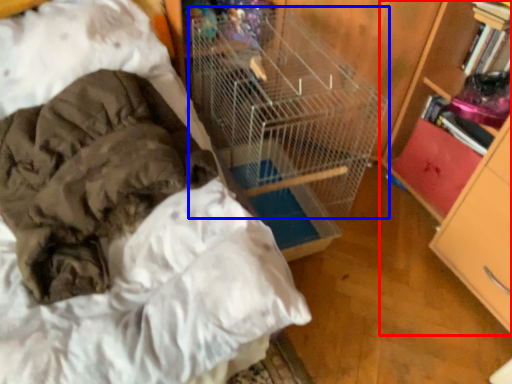
Question: Which of the following is the farthest to the observer, bookcase (highlighted by a red box) or bird cage (highlighted by a blue box)?

Choices:
 (A) bookcase
 (B) bird cage

Answer: (A)